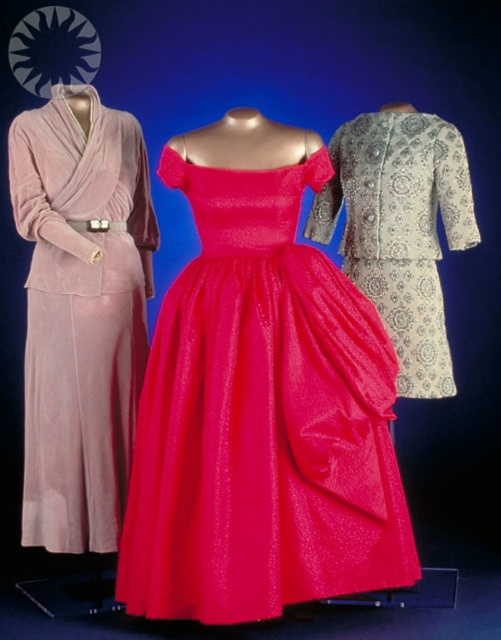
You are a fashion designer who wants to display two dresses side by side in a store window. The shiny taffeta dress at center and the silver metallic dress at right are currently positioned in the image. If you want to place them exactly 12 inches apart for better visibility, should you move them closer together or farther apart?

The shiny taffeta dress at center and silver metallic dress at right are currently 16.42 inches apart. To achieve the desired 12 inches, you need to move them closer together by 4.42 inches.

You are a fashion designer who wants to display these dresses in a store window. The store window has a vertical display space that is 1.8 meters tall. Which dress, the shiny taffeta dress at center or the silver metallic dress at right, would fit better in the display space?

The shiny taffeta dress at center is much taller than the silver metallic dress at right, so it would fit better in the 1.8 meters tall display space if the height requirement is met. However, since the exact height of the shiny taffeta dress isn t provided, we can only compare their relative sizes. If the silver metallic dress is shorter, it might fit within the 1.8 meters limit, but the taller shiny taffeta dress might exceed it. Without specific measurements, it s best to check the actual height of each.